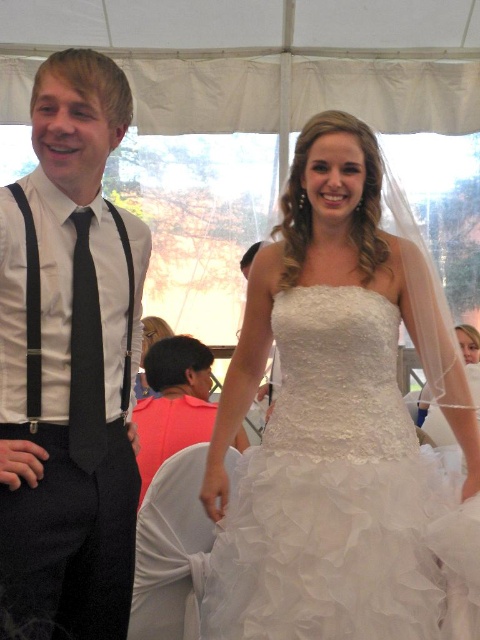
You are a photographer at the event and need to decide which item to focus on first between the pink fabric shirt at center and the black satin tie at left. Since you can only focus on one, which one is larger and thus might be easier to capture clearly?

The pink fabric shirt at center is bigger than the black satin tie at left, so it might be easier to capture clearly as it is larger.

You are an event planner arranging decorations for the wedding. You need to hang a banner between the pink fabric shirt at center and the black satin tie at left. Which object should the banner be hung closer to the bottom of?

The banner should be hung closer to the bottom of the black satin tie at left because the pink fabric shirt at center is not as tall as the black satin tie at left, meaning the black satin tie is taller.

You are a photographer at the event and need to position the two subjects so that their attire is clearly visible. Given the sizes of the white lace dress at center and the black satin tie at left, which one should you focus on first to ensure it stands out more in the photo?

The white lace dress at center is larger in size than the black satin tie at left, so focusing on the white lace dress at center first will ensure it stands out more in the photo.